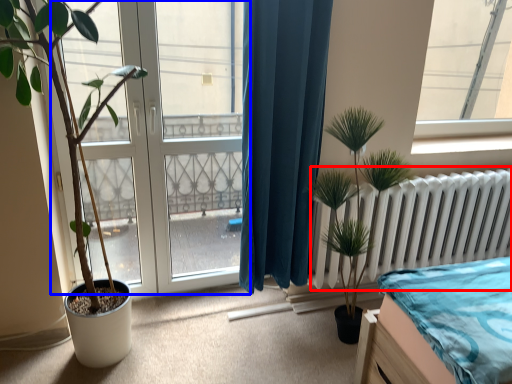
Question: Among these objects, which one is nearest to the camera, radiator (highlighted by a red box) or bay window (highlighted by a blue box)?

Choices:
 (A) radiator
 (B) bay window

Answer: (B)